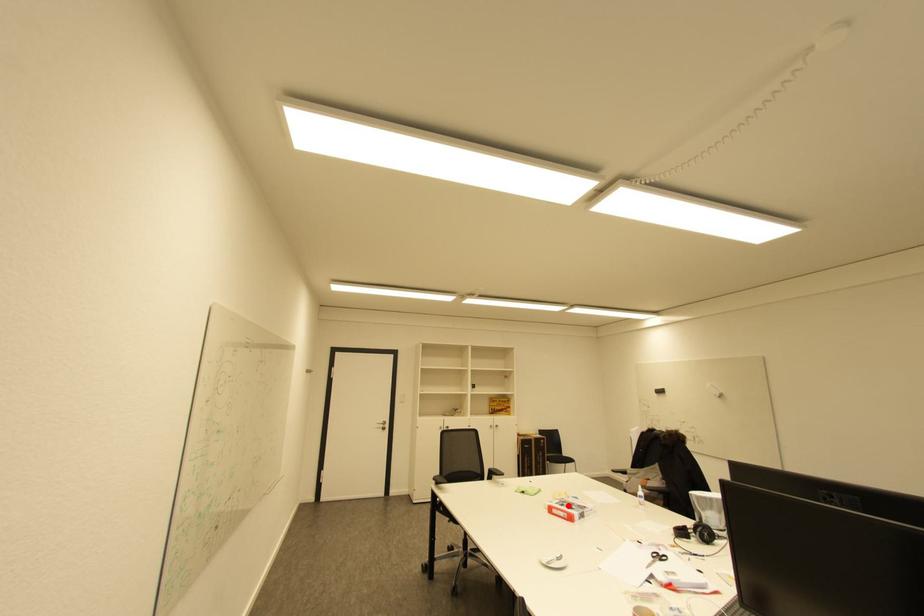
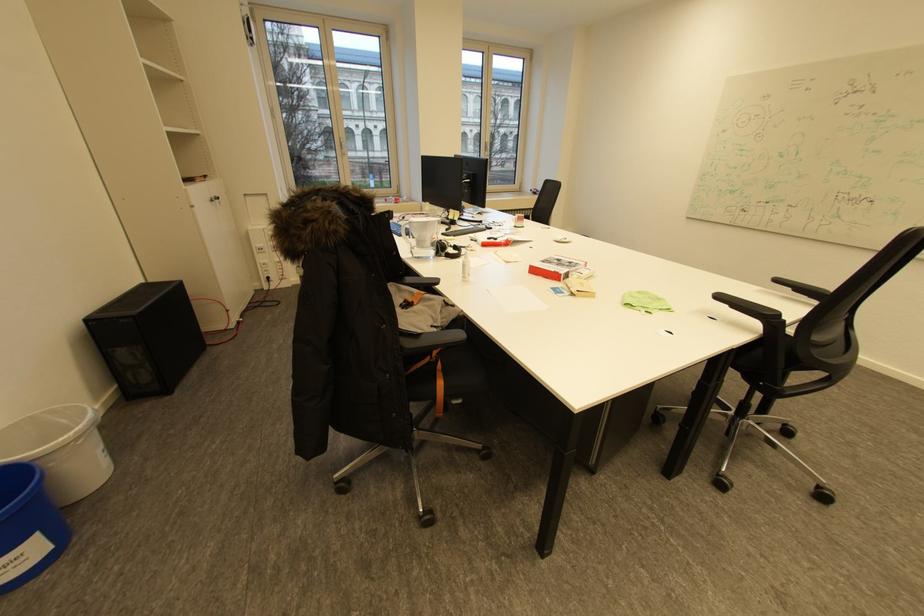
Find the pixel in the second image that matches the highlighted location in the first image.

(576, 262)